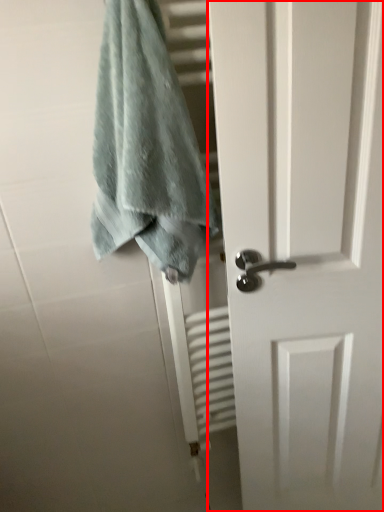
Question: From the image's perspective, what is the correct spatial positioning of door (annotated by the red box) in reference to towel?

Choices:
 (A) above
 (B) below

Answer: (B)